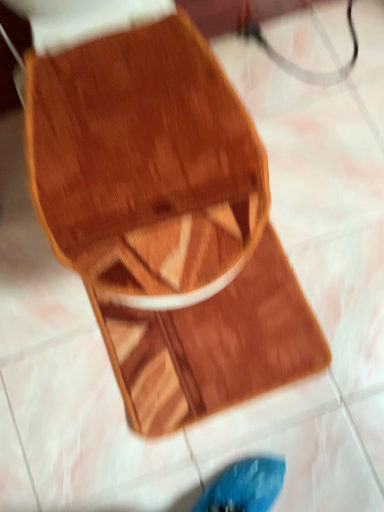
Where is `vacant space underneath wooden cutting board at center (from a real-world perspective)`? This screenshot has height=512, width=384. vacant space underneath wooden cutting board at center (from a real-world perspective) is located at coordinates (218, 355).